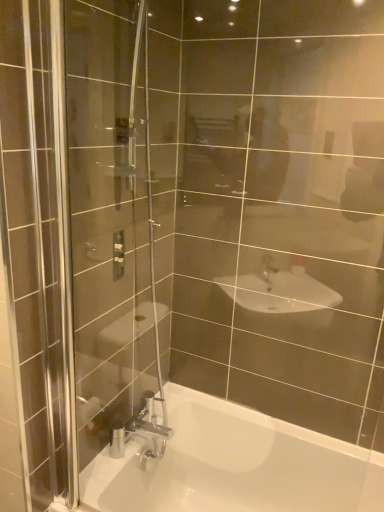
This screenshot has width=384, height=512. What do you see at coordinates (118, 255) in the screenshot?
I see `matte silver shower controls at upper left` at bounding box center [118, 255].

This screenshot has height=512, width=384. Identify the location of matte silver shower controls at upper left. (118, 255).

The width and height of the screenshot is (384, 512). What do you see at coordinates (235, 465) in the screenshot? I see `white glossy bathtub at lower center` at bounding box center [235, 465].

I want to click on white glossy bathtub at lower center, so click(x=235, y=465).

In order to face white glossy bathtub at lower center, should I rotate leftwards or rightwards?

Rotate your view right by about 5.515°.

Where is `matte silver shower controls at upper left`? This screenshot has height=512, width=384. matte silver shower controls at upper left is located at coordinates (118, 255).

Consider the image. Visually, is white glossy bathtub at lower center positioned to the left or to the right of matte silver shower controls at upper left?

white glossy bathtub at lower center is to the right of matte silver shower controls at upper left.

Does white glossy bathtub at lower center lie behind matte silver shower controls at upper left?

No.

Is point (138, 489) closer or farther from the camera than point (119, 234)?

Point (138, 489).

From the image's perspective, which is above, white glossy bathtub at lower center or matte silver shower controls at upper left?

matte silver shower controls at upper left is shown above in the image.

From a real-world perspective, which is physically below, white glossy bathtub at lower center or matte silver shower controls at upper left?

white glossy bathtub at lower center, from a real-world perspective.

Looking at this image, does white glossy bathtub at lower center have a greater width compared to matte silver shower controls at upper left?

Yes, white glossy bathtub at lower center is wider than matte silver shower controls at upper left.

From the picture: Does white glossy bathtub at lower center have a lesser height compared to matte silver shower controls at upper left?

In fact, white glossy bathtub at lower center may be taller than matte silver shower controls at upper left.

Looking at this image, considering the relative sizes of white glossy bathtub at lower center and matte silver shower controls at upper left in the image provided, is white glossy bathtub at lower center bigger than matte silver shower controls at upper left?

Yes, white glossy bathtub at lower center is bigger than matte silver shower controls at upper left.

Could matte silver shower controls at upper left be considered to be inside white glossy bathtub at lower center?

No, matte silver shower controls at upper left is not a part of white glossy bathtub at lower center.

Looking at this image, is white glossy bathtub at lower center with matte silver shower controls at upper left?

No, white glossy bathtub at lower center is not next to matte silver shower controls at upper left.

Is white glossy bathtub at lower center turned away from matte silver shower controls at upper left?

No, matte silver shower controls at upper left is not at the back of white glossy bathtub at lower center.

How many degrees apart are the facing directions of white glossy bathtub at lower center and matte silver shower controls at upper left?

There is a 90-degree angle between the facing directions of white glossy bathtub at lower center and matte silver shower controls at upper left.

Measure the distance from white glossy bathtub at lower center to matte silver shower controls at upper left.

white glossy bathtub at lower center and matte silver shower controls at upper left are 32.99 inches apart from each other.

Where is `shower located behind the white glossy bathtub at lower center`? This screenshot has height=512, width=384. shower located behind the white glossy bathtub at lower center is located at coordinates (118, 255).

Considering the positions of objects matte silver shower controls at upper left and white glossy bathtub at lower center in the image provided, who is more to the right, matte silver shower controls at upper left or white glossy bathtub at lower center?

white glossy bathtub at lower center.

Which object is closer to the camera taking this photo, matte silver shower controls at upper left or white glossy bathtub at lower center?

white glossy bathtub at lower center is closer to the camera.

Which point is more distant from viewer, (114, 247) or (252, 422)?

Positioned behind is point (252, 422).

From the image's perspective, would you say matte silver shower controls at upper left is shown under white glossy bathtub at lower center?

No.

From a real-world perspective, is matte silver shower controls at upper left positioned over white glossy bathtub at lower center based on gravity?

Yes.

Looking at their sizes, would you say matte silver shower controls at upper left is wider or thinner than white glossy bathtub at lower center?

In the image, matte silver shower controls at upper left appears to be more narrow than white glossy bathtub at lower center.

Can you confirm if matte silver shower controls at upper left is shorter than white glossy bathtub at lower center?

Yes.

Which of these two, matte silver shower controls at upper left or white glossy bathtub at lower center, is bigger?

Bigger between the two is white glossy bathtub at lower center.

Is matte silver shower controls at upper left spatially inside white glossy bathtub at lower center, or outside of it?

matte silver shower controls at upper left is outside white glossy bathtub at lower center.

Would you say matte silver shower controls at upper left is a long distance from white glossy bathtub at lower center?

matte silver shower controls at upper left is near white glossy bathtub at lower center, not far away.

Is matte silver shower controls at upper left aimed at white glossy bathtub at lower center?

No, matte silver shower controls at upper left is not facing towards white glossy bathtub at lower center.

In the image, there is a matte silver shower controls at upper left. At what (x,y) coordinates should I click in order to perform the action: click on bathtub below it (from a real-world perspective). Please return your answer as a coordinate pair (x, y). Looking at the image, I should click on (235, 465).

Identify the location of shower behind the white glossy bathtub at lower center. This screenshot has width=384, height=512. (118, 255).

Where is `shower located above the white glossy bathtub at lower center (from the image's perspective)`? shower located above the white glossy bathtub at lower center (from the image's perspective) is located at coordinates (118, 255).